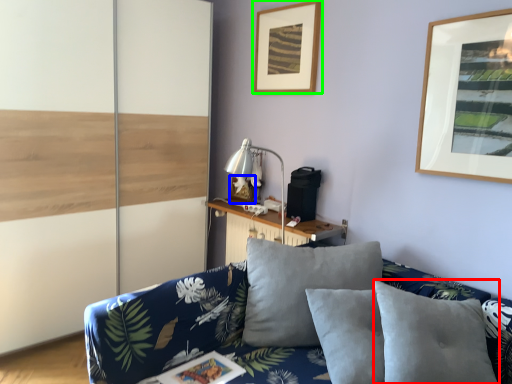
Question: Considering the real-world distances, which object is closest to pillow (highlighted by a red box)? picture frame (highlighted by a blue box) or picture frame (highlighted by a green box).

Choices:
 (A) picture frame
 (B) picture frame

Answer: (A)